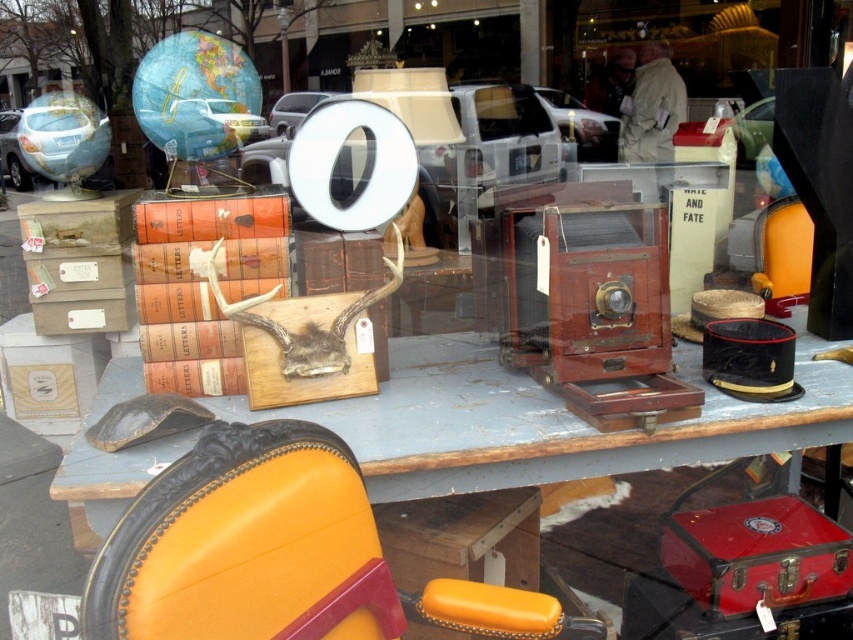
You are a customer browsing the thrift store display window. You see the leather seat at center and the wooden table at center. Which object is taller?

The leather seat at center is taller than the wooden table at center.

You are standing in front of the display window and want to take a closer look at the leather seat at center. If your arm can reach up to 36 inches, can you comfortably touch it without moving your body?

The leather seat at center is 30.90 inches away from the camera. Since your arm can reach up to 36 inches, you can comfortably touch it without moving your body.